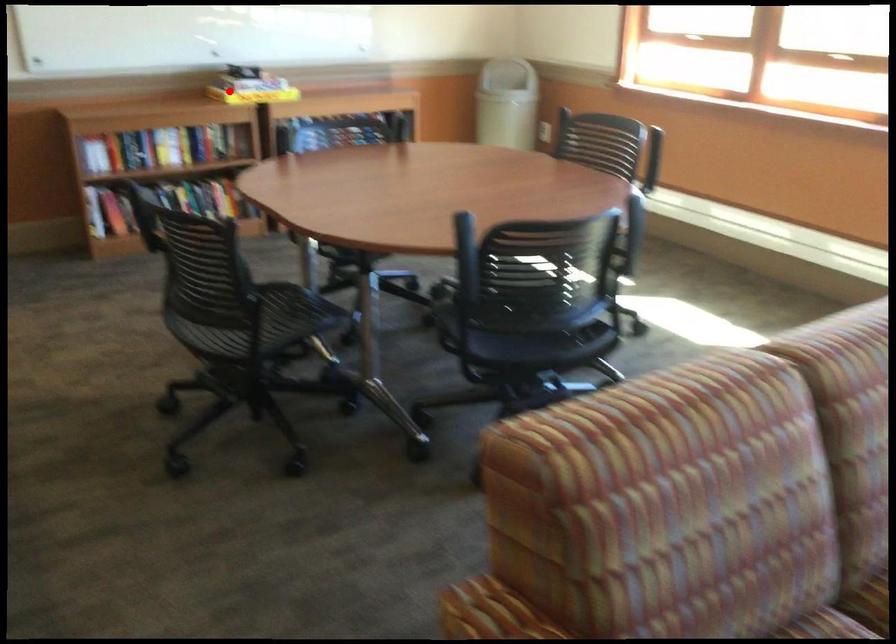
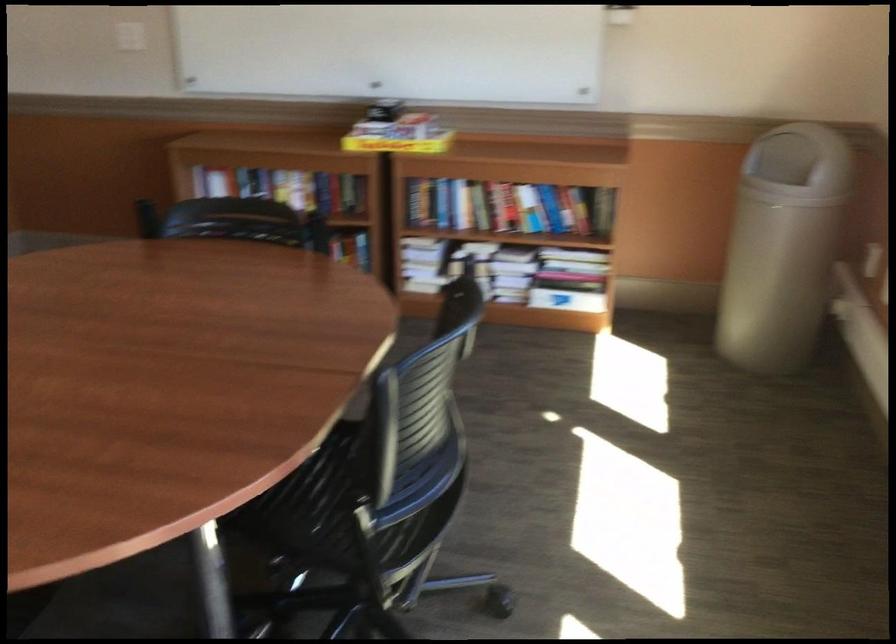
Locate, in the second image, the point that corresponds to the highlighted location in the first image.

(398, 144)